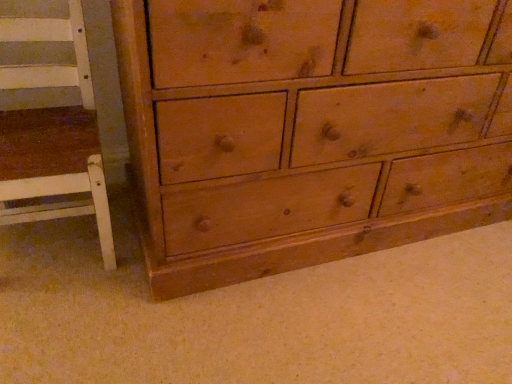
Where is `vacant region under white wood armchair at left (from a real-world perspective)`? This screenshot has width=512, height=384. vacant region under white wood armchair at left (from a real-world perspective) is located at coordinates (46, 242).